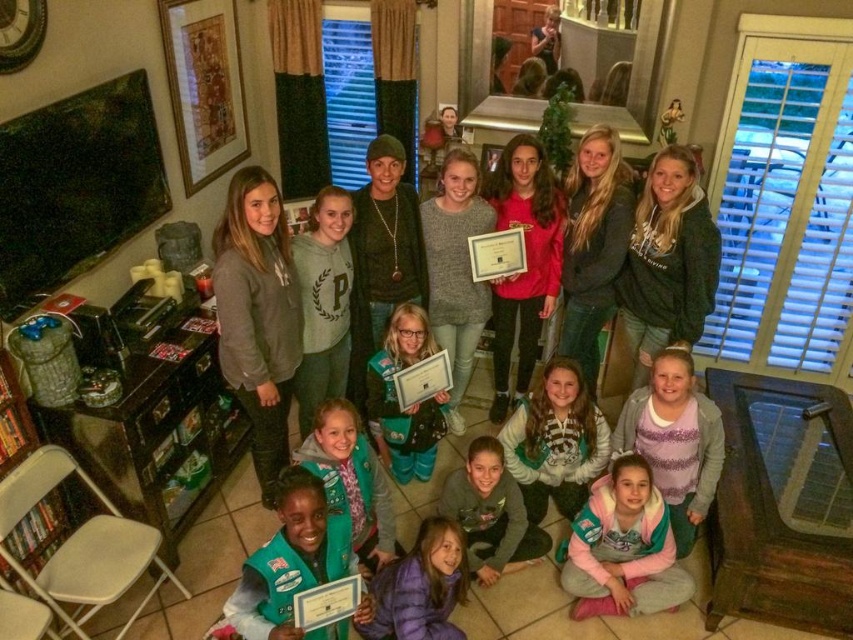
Question: Does green matte/black sweater at center appear over green fleece vest at center?

Choices:
 (A) yes
 (B) no

Answer: (A)

Question: Among these points, which one is farthest from the camera?

Choices:
 (A) (412, 445)
 (B) (515, 520)

Answer: (A)

Question: Is pink fleece jacket at lower center bigger than green uniform at lower left?

Choices:
 (A) no
 (B) yes

Answer: (A)

Question: Which of the following is the closest to the observer?

Choices:
 (A) purple down jacket at lower center
 (B) pink fleece jacket at lower center
 (C) green fleece vest at center
 (D) green uniform at lower left

Answer: (D)

Question: Which object is the closest to the purple fleece jacket at lower center?

Choices:
 (A) purple down jacket at lower center
 (B) green uniform at lower left
 (C) pink fleece jacket at lower center
 (D) green uniform at center

Answer: (C)

Question: Considering the relative positions of purple fleece jacket at lower center and green uniform at center in the image provided, where is purple fleece jacket at lower center located with respect to green uniform at center?

Choices:
 (A) above
 (B) below

Answer: (B)